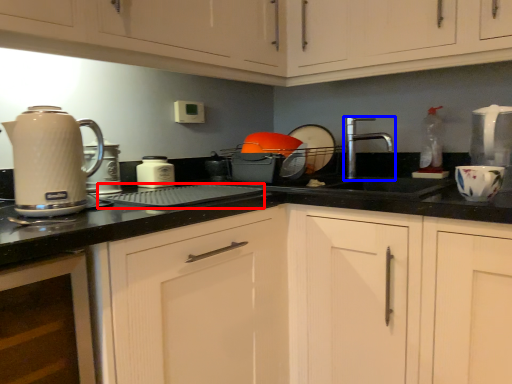
Question: Which of the following is the closest to the observer, appliance (highlighted by a red box) or tap (highlighted by a blue box)?

Choices:
 (A) appliance
 (B) tap

Answer: (A)